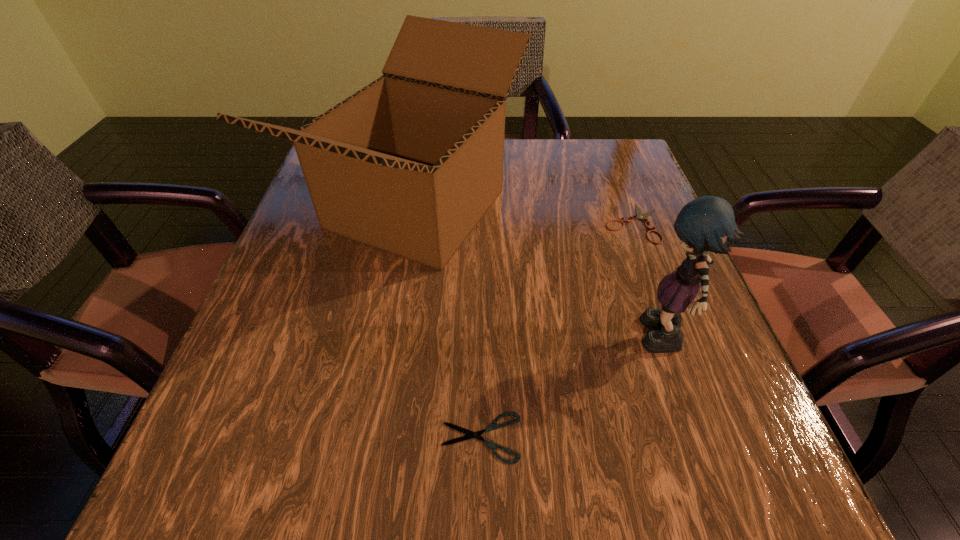
Locate an element on the screen. vacant space at the left edge of the desktop is located at coordinates (290, 430).

Locate an element on the screen. The image size is (960, 540). vacant position at the right edge of the desktop is located at coordinates (612, 266).

Locate an element on the screen. The height and width of the screenshot is (540, 960). vacant space at the far right corner of the desktop is located at coordinates (583, 191).

The image size is (960, 540). Find the location of `free area in between the box and the rag doll`. free area in between the box and the rag doll is located at coordinates (540, 275).

This screenshot has height=540, width=960. I want to click on unoccupied position between the right shears and the box, so click(525, 216).

The height and width of the screenshot is (540, 960). I want to click on unoccupied area between the rag doll and the shorter shears, so click(572, 390).

Find the location of `vacant space that is in between the rag doll and the box`. vacant space that is in between the rag doll and the box is located at coordinates (540, 275).

At what (x,y) coordinates should I click in order to perform the action: click on free space between the third tallest object and the box. Please return your answer as a coordinate pair (x, y). Looking at the image, I should click on (525, 216).

Image resolution: width=960 pixels, height=540 pixels. I want to click on vacant point located between the right shears and the rag doll, so (648, 282).

Find the location of `vacant space that is in between the nearest object and the farther shears`. vacant space that is in between the nearest object and the farther shears is located at coordinates (558, 330).